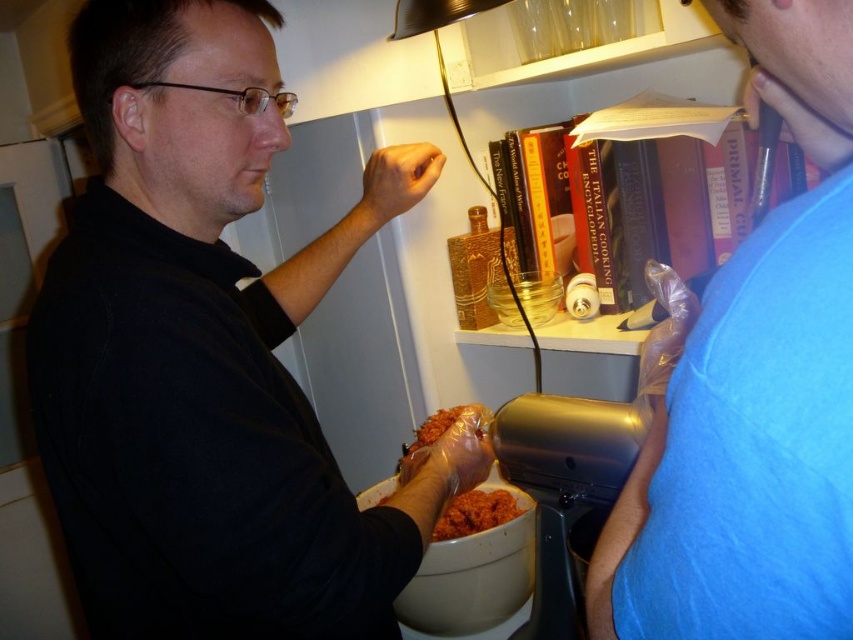
You are a delivery person who needs to locate the black matte shirt at center in the kitchen. According to the coordinates provided, where would you find it?

The black matte shirt at center is located at coordinates point (207, 353).

In the scene shown: You are standing in the kitchen and need to pass the shiny plastic food at center to the person in the blue fabric shirt at upper right. Can you hand it directly to them without moving the food processor?

The blue fabric shirt at upper right is to the right of the shiny plastic food at center, so you can hand it directly to them without moving the food processor.